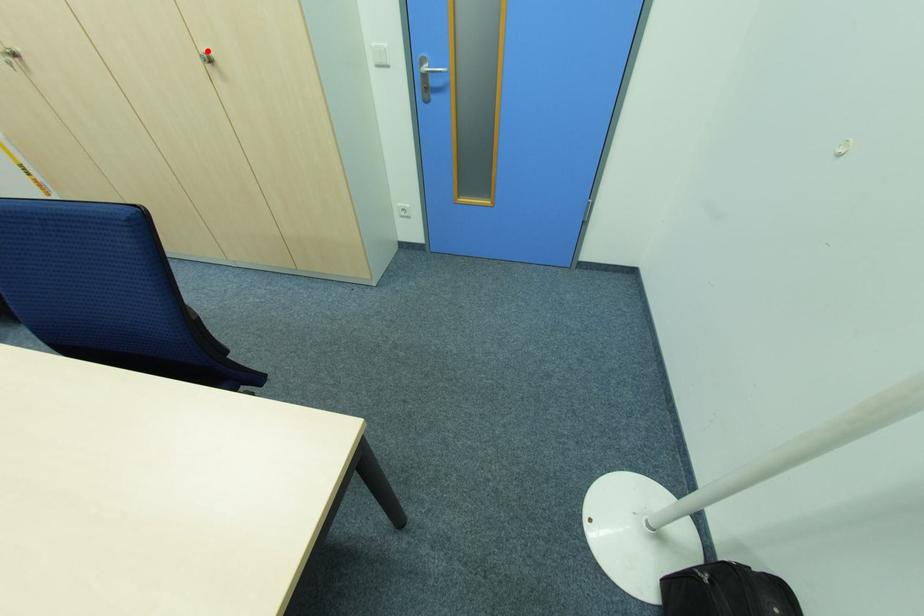
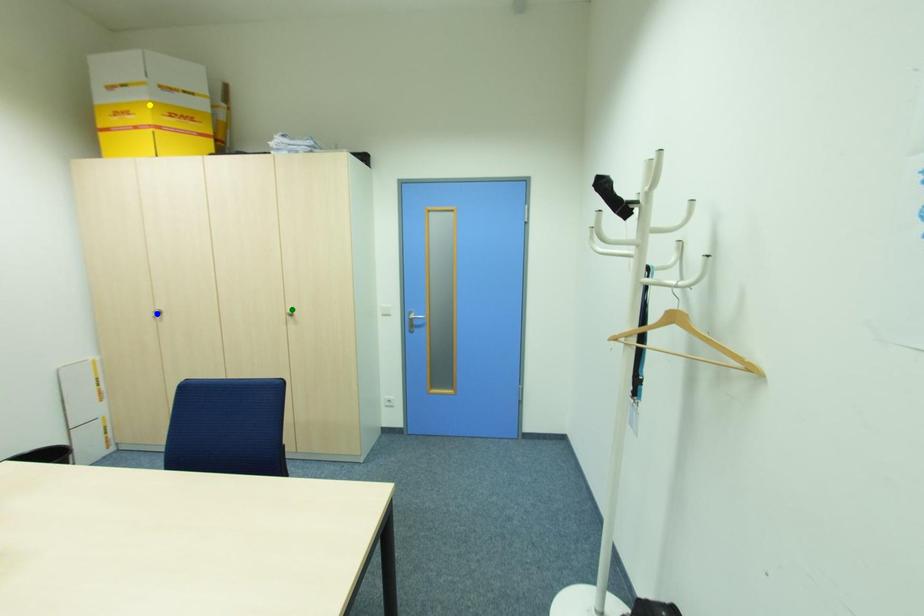
Question: I am providing you with two images of the same scene from different viewpoints. A red point is marked on the first image. You are given multiple points on the second image. In image 2, which mark is for the same physical point as the one in image 1?

Choices:
 (A) yellow point
 (B) green point
 (C) blue point

Answer: (B)